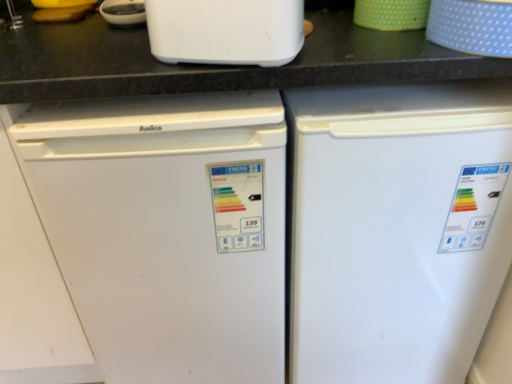
Question: Considering the relative sizes of green dotted cup at upper right, the second appliance positioned from the right, and blue dotted fabric at upper right, the first appliance viewed from the right, in the image provided, is green dotted cup at upper right, the second appliance positioned from the right, shorter than blue dotted fabric at upper right, the first appliance viewed from the right,?

Choices:
 (A) no
 (B) yes

Answer: (B)

Question: Is green dotted cup at upper right, which appears as the 1th appliance when viewed from the left, to the left of blue dotted fabric at upper right, the first appliance viewed from the right, from the viewer's perspective?

Choices:
 (A) yes
 (B) no

Answer: (A)

Question: Can we say green dotted cup at upper right, the second appliance positioned from the right, lies outside blue dotted fabric at upper right, which ranks as the second appliance in left-to-right order?

Choices:
 (A) yes
 (B) no

Answer: (A)

Question: Can you confirm if green dotted cup at upper right, the second appliance positioned from the right, is positioned to the right of blue dotted fabric at upper right, which ranks as the second appliance in left-to-right order?

Choices:
 (A) yes
 (B) no

Answer: (B)

Question: From a real-world perspective, is green dotted cup at upper right, which appears as the 1th appliance when viewed from the left, located beneath blue dotted fabric at upper right, which ranks as the second appliance in left-to-right order?

Choices:
 (A) yes
 (B) no

Answer: (A)

Question: Is white plastic toaster at upper center situated inside blue dotted fabric at upper right, the first appliance viewed from the right, or outside?

Choices:
 (A) outside
 (B) inside

Answer: (A)

Question: Considering the positions of white plastic toaster at upper center and blue dotted fabric at upper right, which ranks as the second appliance in left-to-right order, in the image, is white plastic toaster at upper center wider or thinner than blue dotted fabric at upper right, which ranks as the second appliance in left-to-right order,?

Choices:
 (A) thin
 (B) wide

Answer: (A)

Question: Would you say white plastic toaster at upper center is to the left or to the right of blue dotted fabric at upper right, which ranks as the second appliance in left-to-right order, in the picture?

Choices:
 (A) right
 (B) left

Answer: (B)

Question: Does point (230, 1) appear closer or farther from the camera than point (456, 39)?

Choices:
 (A) closer
 (B) farther

Answer: (A)

Question: Relative to white matte refrigerator at center, which appears as the second refrigerator when viewed from the left, is white matte refrigerator at left, the first refrigerator from the left, in front or behind?

Choices:
 (A) front
 (B) behind

Answer: (A)

Question: Considering the positions of point (188, 114) and point (468, 89), is point (188, 114) closer or farther from the camera than point (468, 89)?

Choices:
 (A) closer
 (B) farther

Answer: (A)

Question: Considering the positions of white matte refrigerator at left, the first refrigerator from the left, and white matte refrigerator at center, which is the 1th refrigerator in right-to-left order, in the image, is white matte refrigerator at left, the first refrigerator from the left, wider or thinner than white matte refrigerator at center, which is the 1th refrigerator in right-to-left order,?

Choices:
 (A) wide
 (B) thin

Answer: (B)

Question: In the image, is white matte refrigerator at left, the second refrigerator when ordered from right to left, on the left side or the right side of white matte refrigerator at center, which is the 1th refrigerator in right-to-left order?

Choices:
 (A) right
 (B) left

Answer: (B)

Question: Considering their positions, is white matte refrigerator at left, the second refrigerator when ordered from right to left, located in front of or behind white plastic toaster at upper center?

Choices:
 (A) front
 (B) behind

Answer: (B)

Question: In terms of width, does white matte refrigerator at left, the first refrigerator from the left, look wider or thinner when compared to white plastic toaster at upper center?

Choices:
 (A) wide
 (B) thin

Answer: (A)